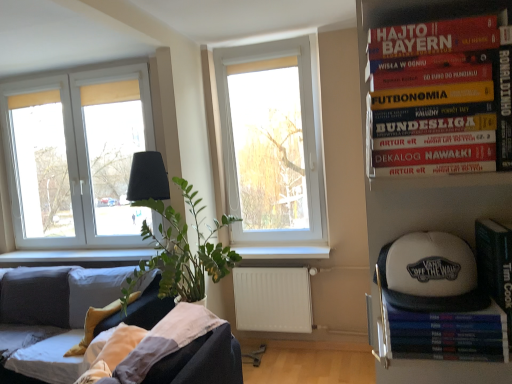
I want to click on empty space that is ontop of white plastic window at left, which is the first window in left-to-right order, so click(x=63, y=67).